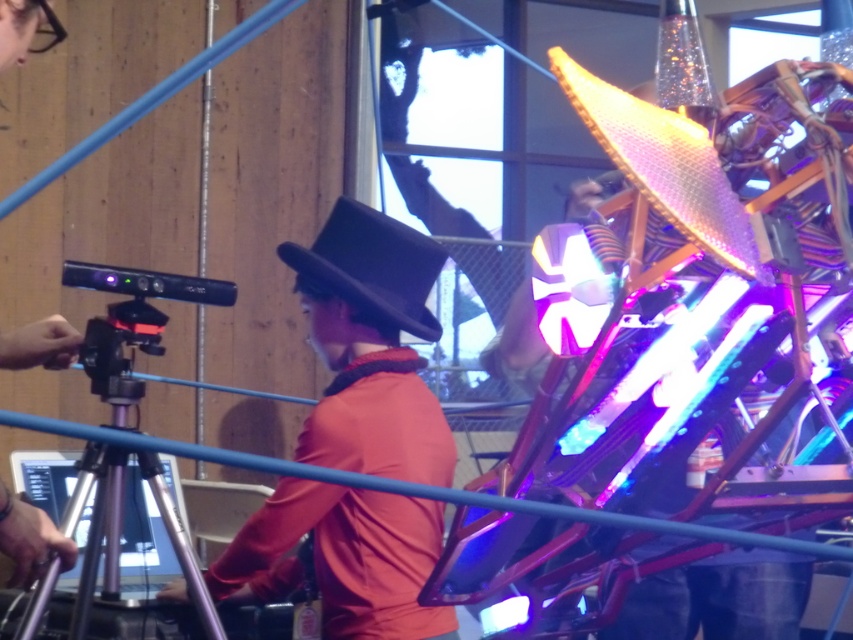
Question: Which point is farther to the camera?

Choices:
 (A) (18, 545)
 (B) (392, 570)
 (C) (86, 472)

Answer: (C)

Question: In this image, where is silver metallic tripod at lower left located relative to black felt hat at center?

Choices:
 (A) right
 (B) left

Answer: (B)

Question: Is silver metallic tripod at lower left further to camera compared to black felt hat at center?

Choices:
 (A) yes
 (B) no

Answer: (B)

Question: In this image, where is matte black hat at center located relative to black felt hat at center?

Choices:
 (A) right
 (B) left

Answer: (B)

Question: Which of the following is the farthest from the observer?

Choices:
 (A) (350, 209)
 (B) (421, 280)
 (C) (206, 621)

Answer: (B)

Question: Which of the following is the closest to the observer?

Choices:
 (A) (47, 516)
 (B) (363, 301)
 (C) (83, 604)
 (D) (408, 529)

Answer: (A)